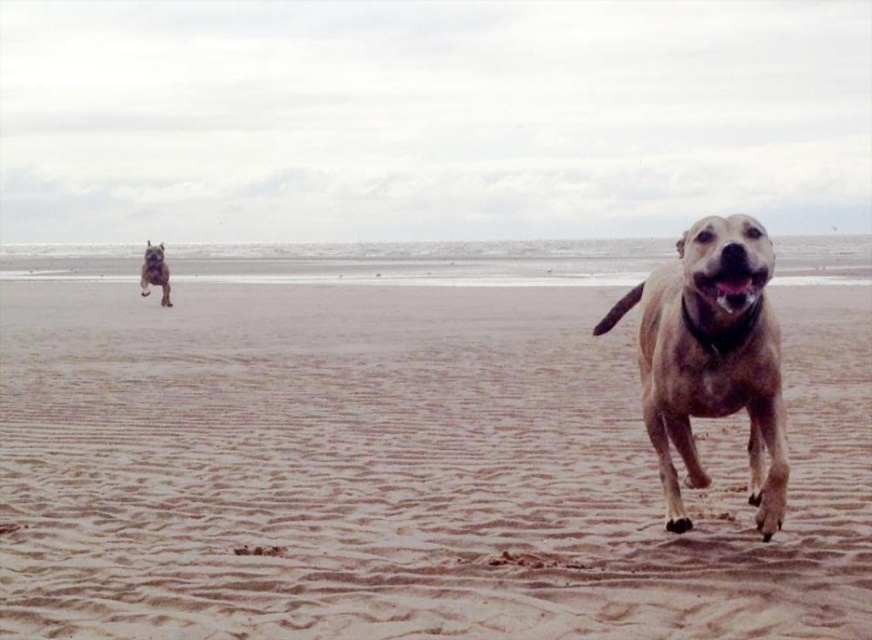
Does brown sandy beach at center appear over shiny brown fur at upper left?

No.

Is brown sandy beach at center thinner than shiny brown fur at upper left?

No, brown sandy beach at center is not thinner than shiny brown fur at upper left.

Is point (193, 605) less distant than point (161, 275)?

That is True.

The image size is (872, 640). I want to click on brown sandy beach at center, so click(404, 470).

Between golden-brown fur dog at right and shiny brown fur at upper left, which one appears on the left side from the viewer's perspective?

shiny brown fur at upper left is more to the left.

Locate an element on the screen. This screenshot has width=872, height=640. golden-brown fur dog at right is located at coordinates (712, 356).

Between point (336, 349) and point (654, 394), which one is positioned in front?

Positioned in front is point (654, 394).

Is brown sandy beach at center closer to camera compared to golden-brown fur dog at right?

No, it is behind golden-brown fur dog at right.

This screenshot has height=640, width=872. Describe the element at coordinates (404, 470) in the screenshot. I see `brown sandy beach at center` at that location.

At what (x,y) coordinates should I click in order to perform the action: click on brown sandy beach at center. Please return your answer as a coordinate pair (x, y). Image resolution: width=872 pixels, height=640 pixels. Looking at the image, I should click on (404, 470).